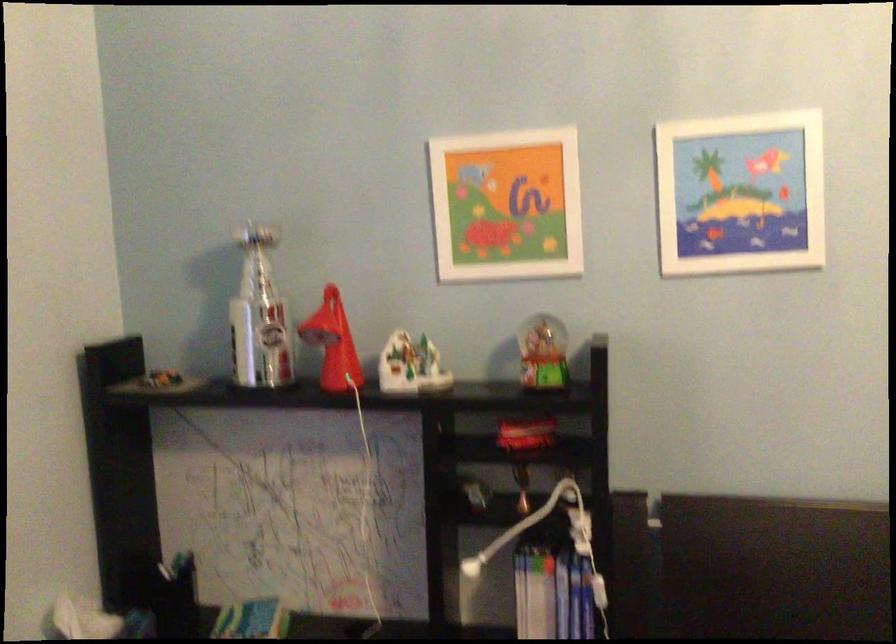
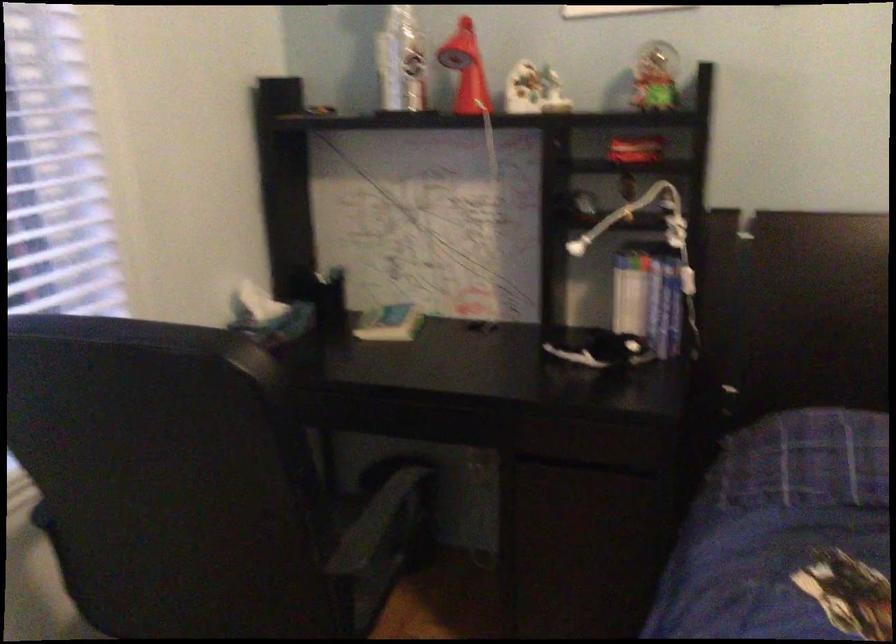
In the second image, find the point that corresponds to pixel 333 346 in the first image.

(466, 69)